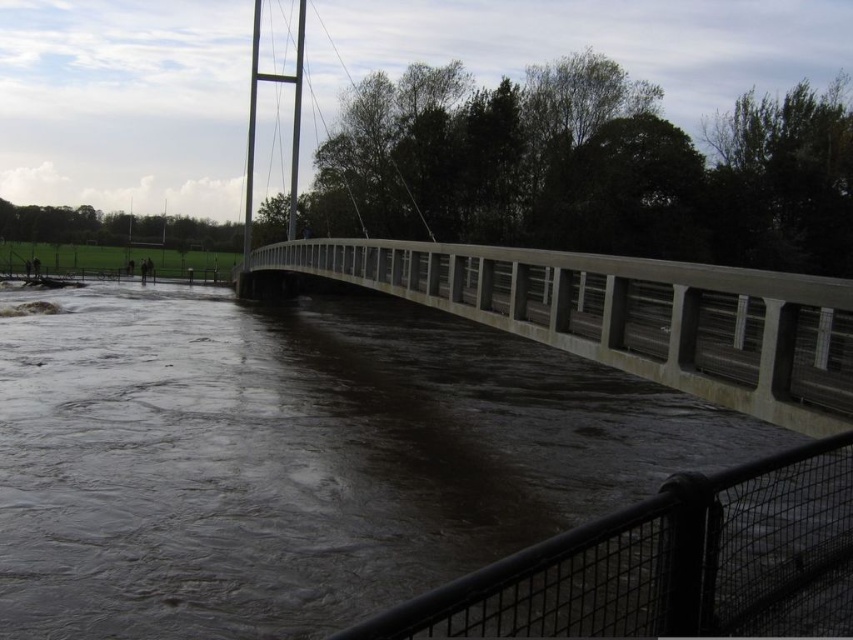
Is brown concrete river at center to the right of concrete bridge at center from the viewer's perspective?

No, brown concrete river at center is not to the right of concrete bridge at center.

Which of these two, brown concrete river at center or concrete bridge at center, stands taller?

Standing taller between the two is concrete bridge at center.

Describe the element at coordinates (299, 458) in the screenshot. I see `brown concrete river at center` at that location.

Where is `brown concrete river at center`? This screenshot has width=853, height=640. brown concrete river at center is located at coordinates (299, 458).